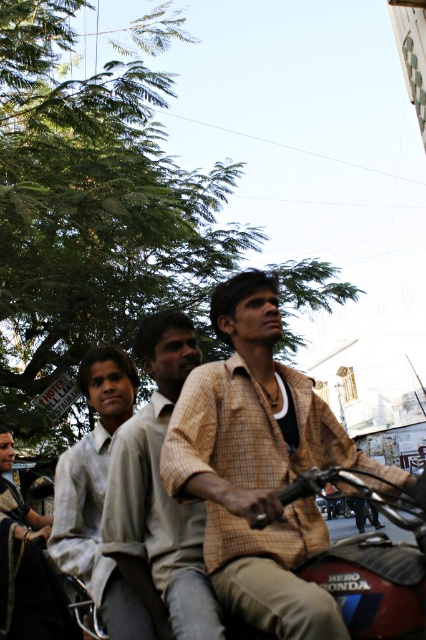
Question: Which of the following is the closest to the observer?

Choices:
 (A) (402, 499)
 (B) (2, 461)
 (C) (63, 483)
 (D) (163, 422)

Answer: (A)

Question: Which of the following is the closest to the observer?

Choices:
 (A) (321, 403)
 (B) (20, 531)
 (C) (134, 385)
 (D) (422, 513)

Answer: (D)

Question: Can you confirm if red glossy motorcycle at center is thinner than light gray shirt at left?

Choices:
 (A) yes
 (B) no

Answer: (A)

Question: Which point is closer to the camera taking this photo?

Choices:
 (A) (63, 477)
 (B) (127, 460)

Answer: (B)

Question: Observing the image, what is the correct spatial positioning of light brown checkered shirt at center in reference to light gray shirt at left?

Choices:
 (A) right
 (B) left

Answer: (A)

Question: Does red glossy motorcycle at center have a greater width compared to dark green fabric sari at lower left?

Choices:
 (A) yes
 (B) no

Answer: (A)